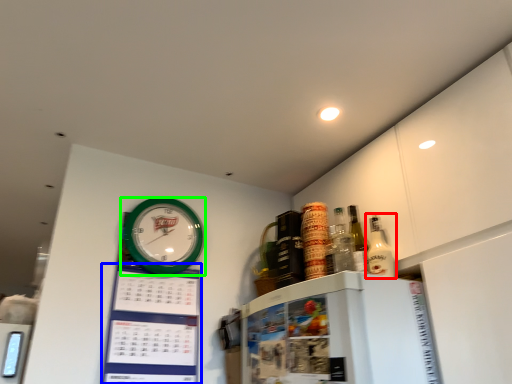
Question: Which object is the farthest from bottle (highlighted by a red box)? Choose among these: bulletin board (highlighted by a blue box) or wall clock (highlighted by a green box).

Choices:
 (A) bulletin board
 (B) wall clock

Answer: (A)